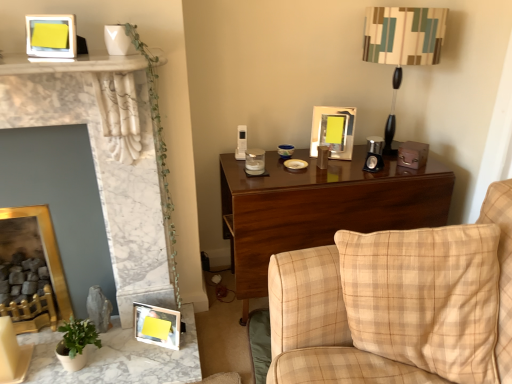
Find the location of a particular element. This screenshot has height=384, width=512. vacant space to the right of green matte plant at lower left is located at coordinates (125, 359).